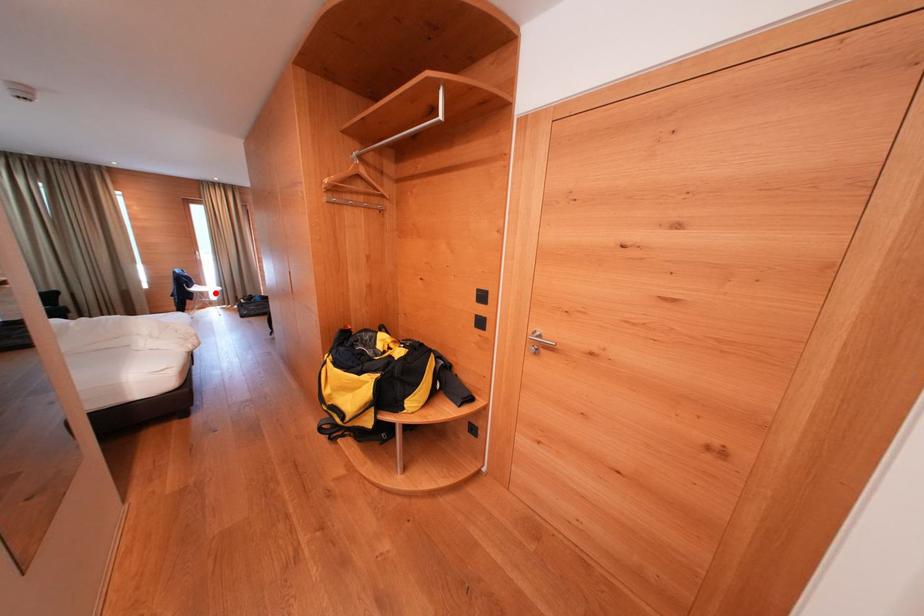
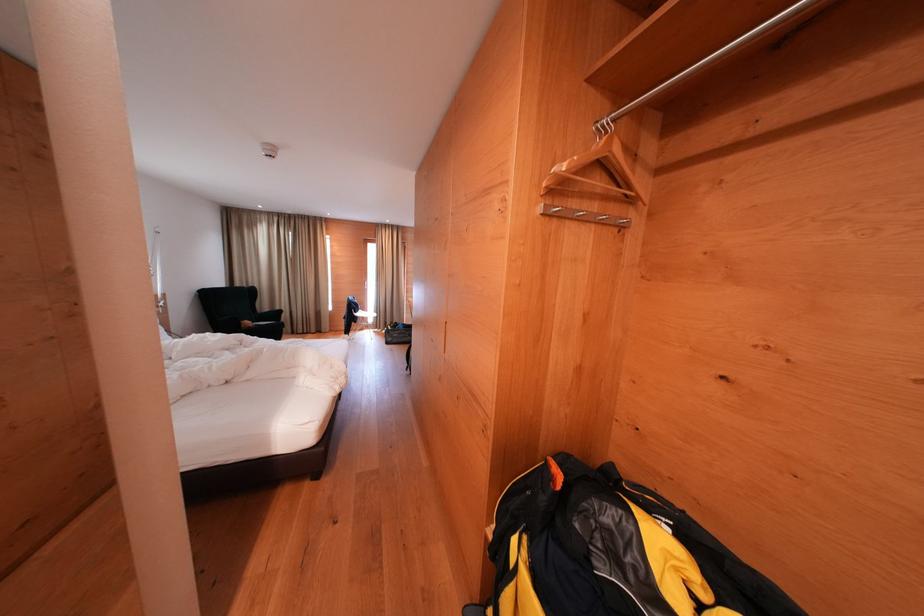
The point at the highlighted location is marked in the first image. Where is the corresponding point in the second image?

(374, 318)